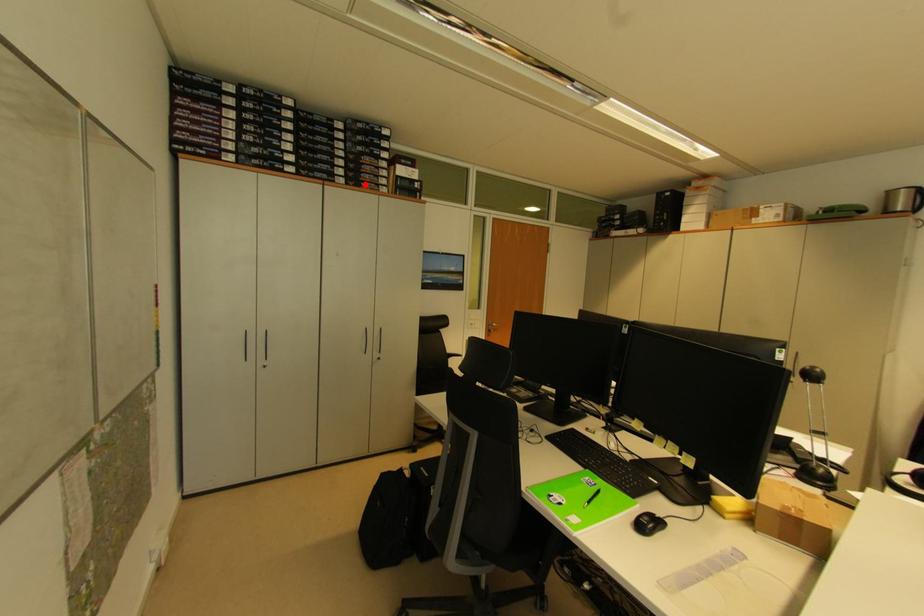
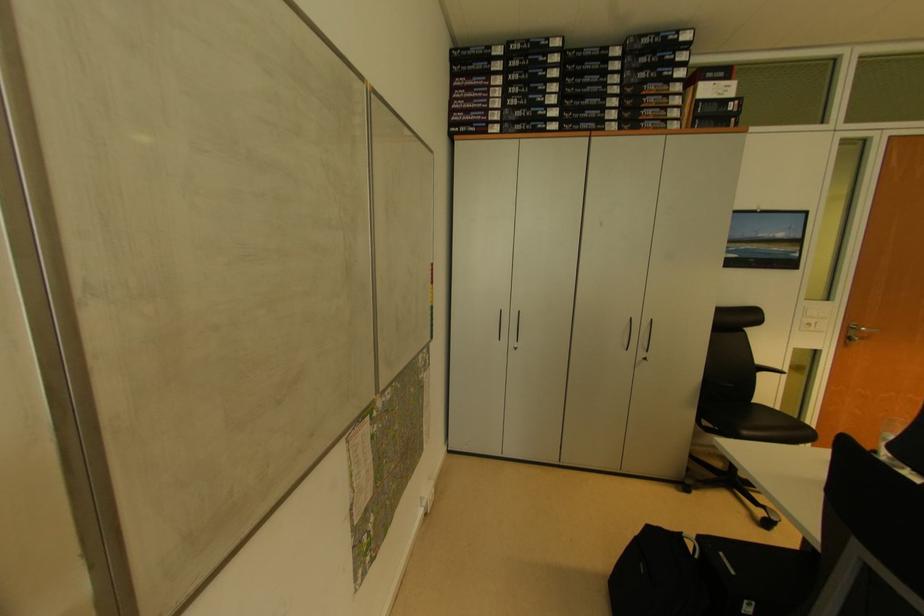
The point at the highlighted location is marked in the first image. Where is the corresponding point in the second image?

(646, 124)